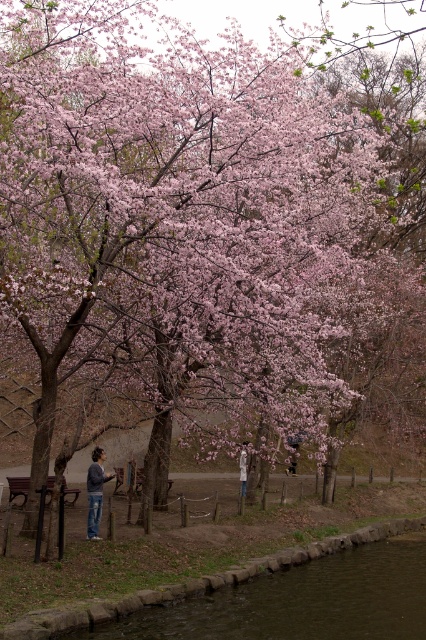
You are a photographer setting up a tripod in the park. You need to place the tripod between the denim jeans at center and the light brown leather jacket at center so that it doesn not block either item. Given that the tripod requires 1 meter of space to avoid obstruction, is there enough space between them?

The denim jeans at center might be wider than light brown leather jacket at center, but without exact measurements, it is uncertain if the space between them is at least 1 meter. Check the actual distance before placing the tripod.

You are standing in the park and see the denim jeans at center. Based on their position, can you determine if they are closer to the large tree with blossoms or the water near the stone wall?

The denim jeans at center is located at point 0.769 on the x and 0.225 on the y axis. Since the tree is at the center of the image and the water is at the bottom, the jeans are closer to the tree than the water.

You are standing in the park looking at the cherry blossom tree. There are two points marked in the image. The first point is at coordinates point [97,449] and the second point is at point [118,474]. Which point is closer to you?

Point [97,449] is closer to the camera than point [118,474].